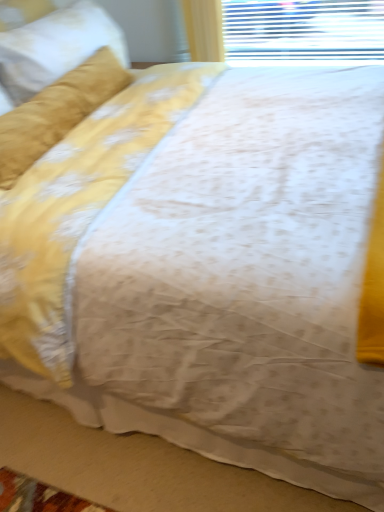
This screenshot has width=384, height=512. In order to click on suede-like yellow pillow at left in this screenshot , I will do `click(56, 47)`.

What is the approximate width of suede-like yellow pillow at left?

17.18 inches.

What do you see at coordinates (56, 47) in the screenshot? The image size is (384, 512). I see `suede-like yellow pillow at left` at bounding box center [56, 47].

Measure the distance between suede-like yellow pillow at left and camera.

suede-like yellow pillow at left is 1.41 meters away from camera.

This screenshot has height=512, width=384. I want to click on suede-like yellow pillow at left, so click(56, 47).